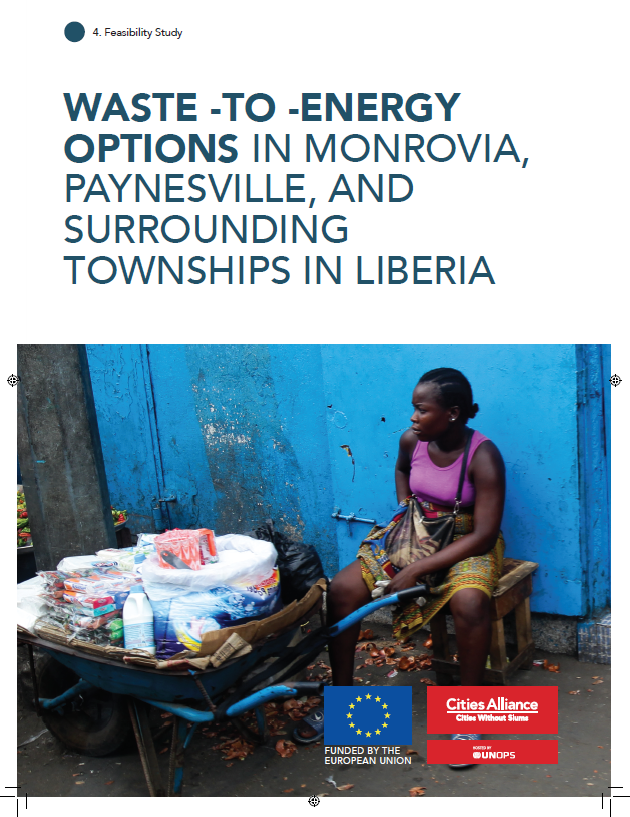
The height and width of the screenshot is (817, 630). I want to click on blue door, so click(x=353, y=363).